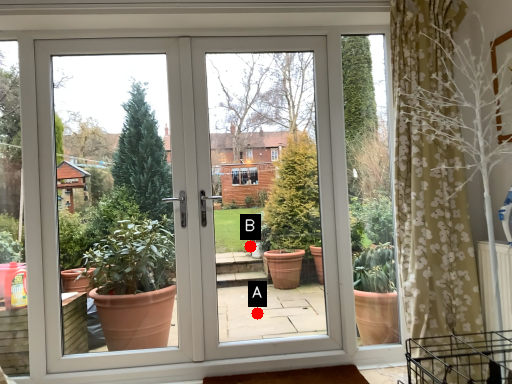
Question: Two points are circled on the image, labeled by A and B beside each circle. Which point is closer to the camera?

Choices:
 (A) A is closer
 (B) B is closer

Answer: (B)